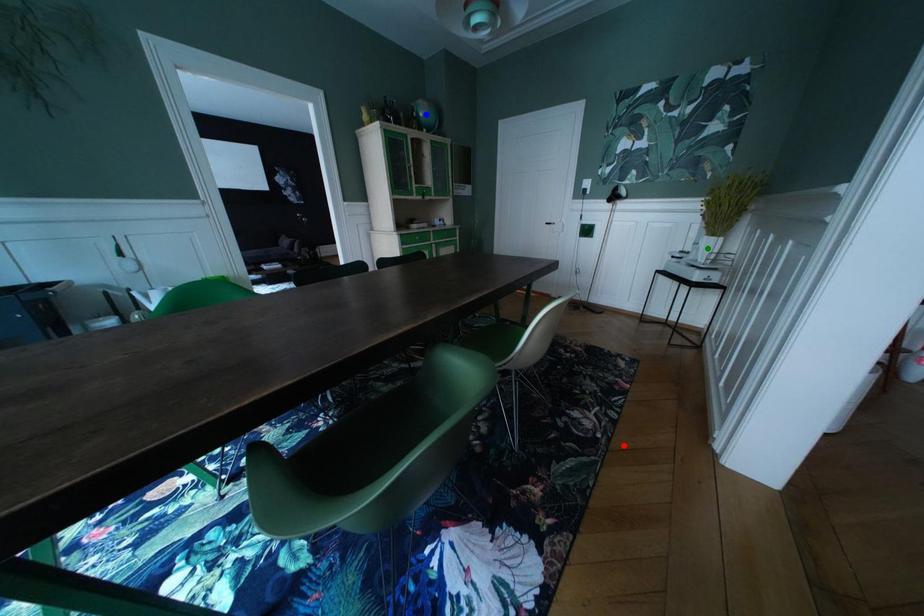
Order these from nearest to farthest:
green point, blue point, red point

red point
green point
blue point